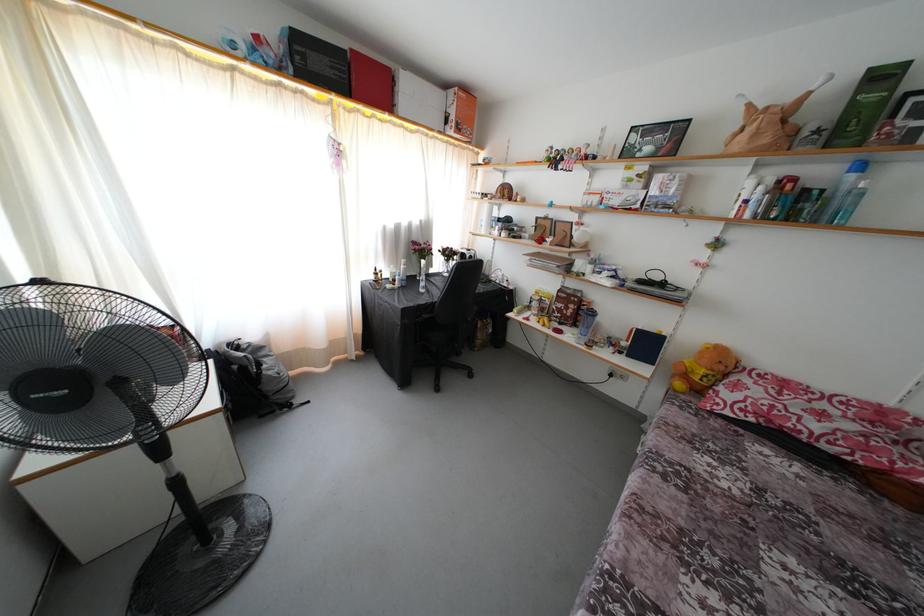
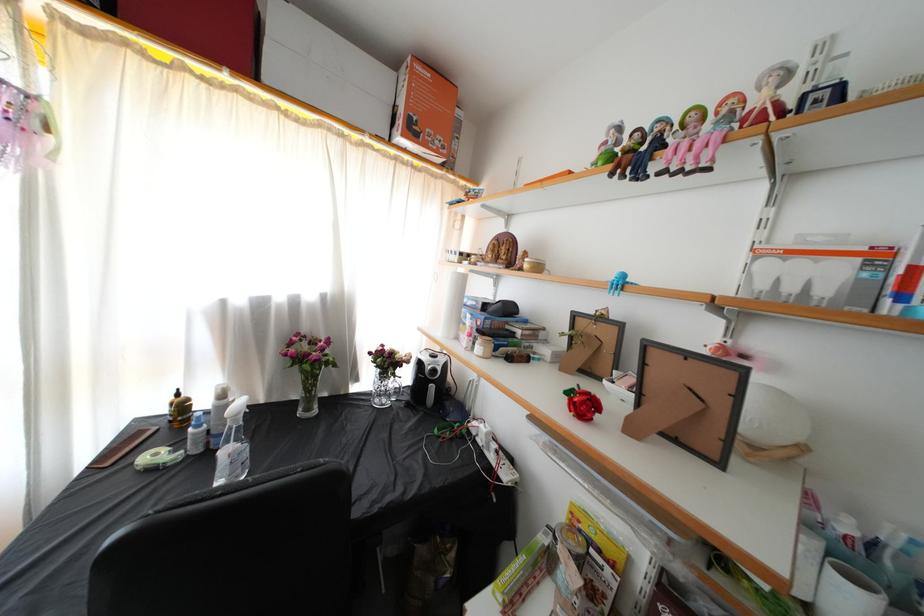
In the second image, find the point that corresponds to point 463,134 in the first image.

(418, 137)